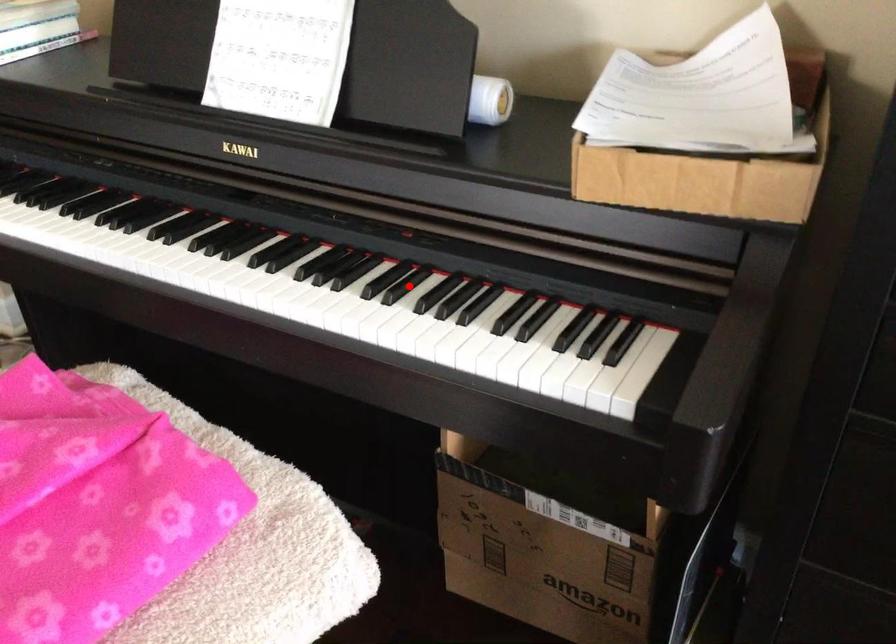
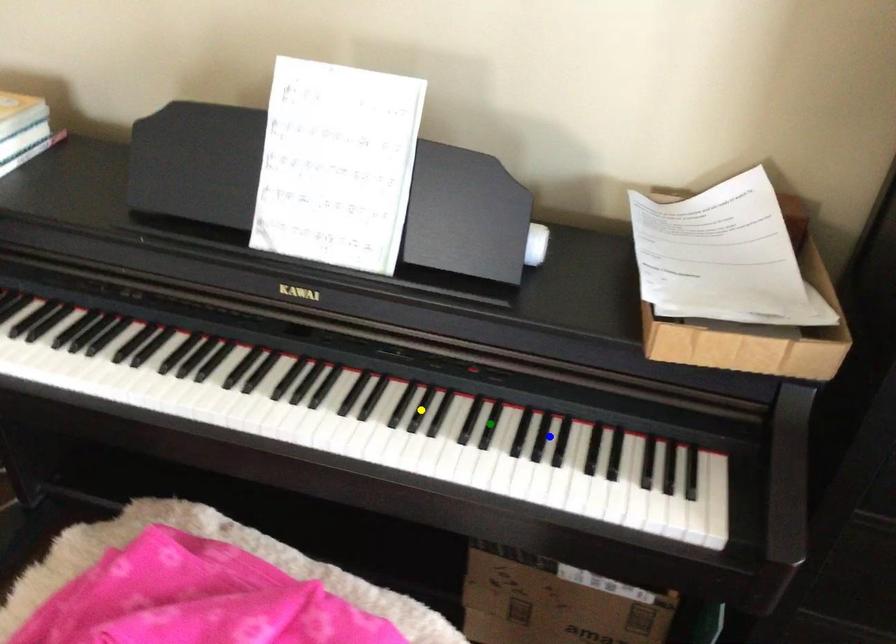
Question: I am providing you with two images of the same scene from different viewpoints. A red point is marked on the first image. You are given multiple points on the second image. Which point in image 2 is actually the same real-world point as the red point in image 1?

Choices:
 (A) yellow point
 (B) blue point
 (C) green point

Answer: (C)